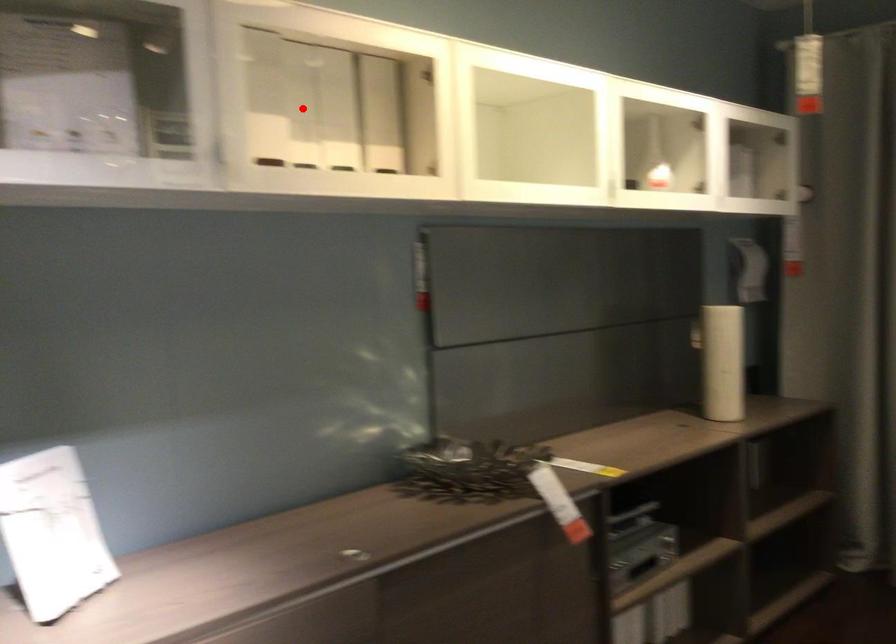
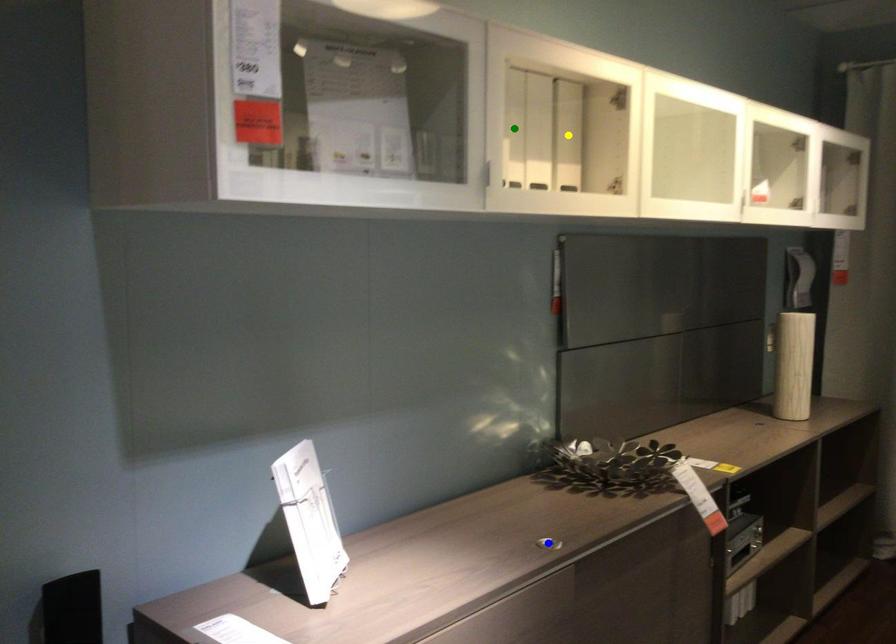
Question: I am providing you with two images of the same scene from different viewpoints. A red point is marked on the first image. You are given multiple points on the second image. Which point in image 2 represents the same 3d spot as the red point in image 1?

Choices:
 (A) yellow point
 (B) green point
 (C) blue point

Answer: (B)